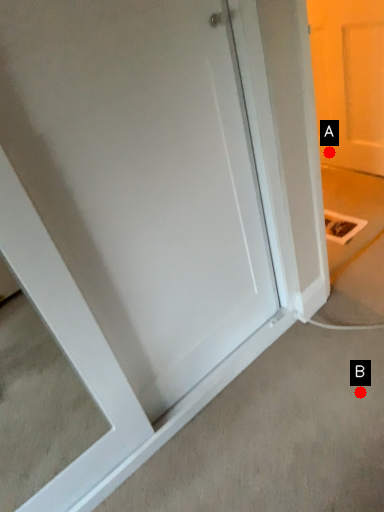
Question: Two points are circled on the image, labeled by A and B beside each circle. Among these points, which one is farthest from the camera?

Choices:
 (A) A is further
 (B) B is further

Answer: (A)